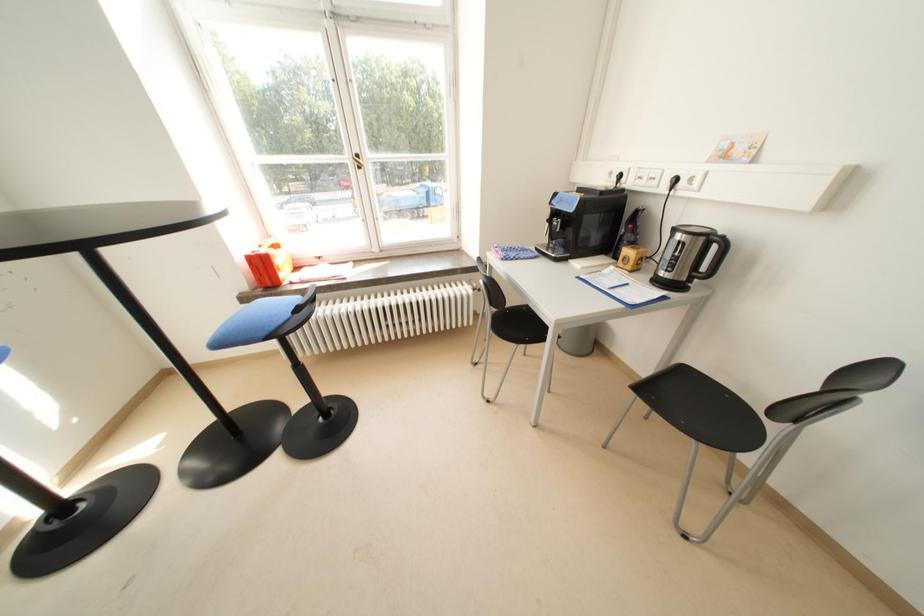
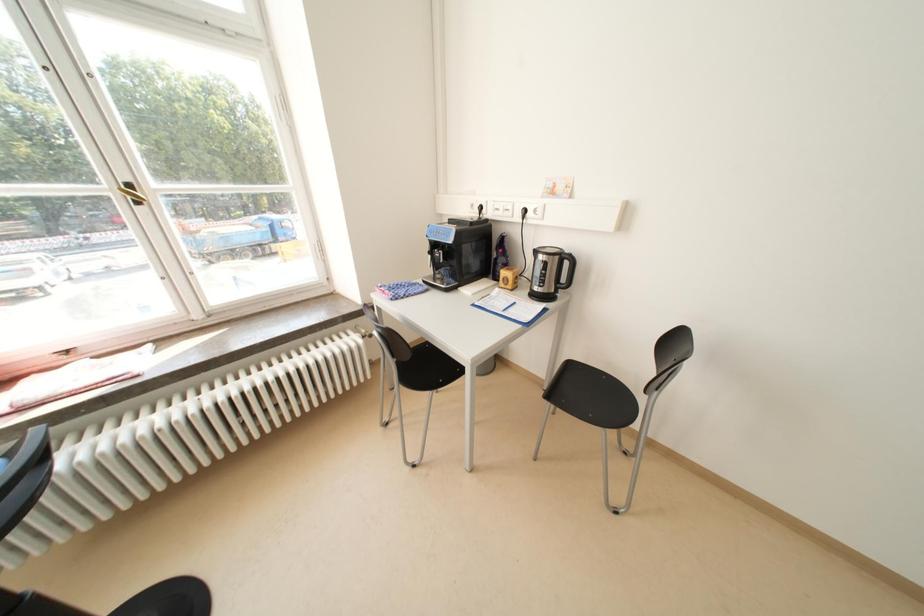
Question: The camera is either moving clockwise (left) or counter-clockwise (right) around the object. The first image is from the beginning of the video and the second image is from the end. Is the camera moving left or right when shooting the video?

Choices:
 (A) Left
 (B) Right

Answer: (A)